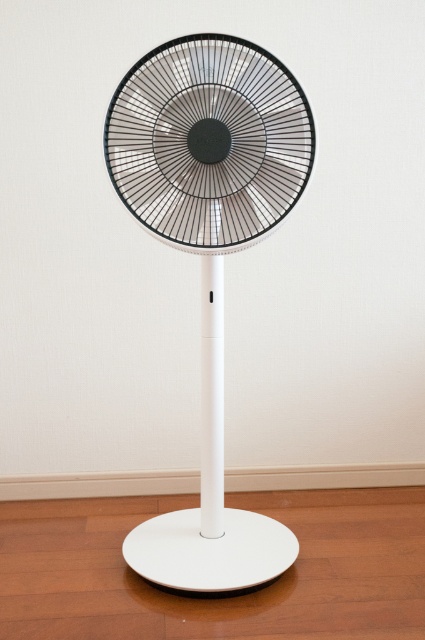
Is point (175, 529) closer to camera compared to point (235, 214)?

No, it is behind (235, 214).

Measure the distance between white plastic fan at center and camera.

white plastic fan at center and camera are 4.38 feet apart from each other.

Who is more distant from viewer, (136, 115) or (272, 84)?

Point (136, 115)

Where is `white plastic fan at center`? The width and height of the screenshot is (425, 640). white plastic fan at center is located at coordinates (209, 257).